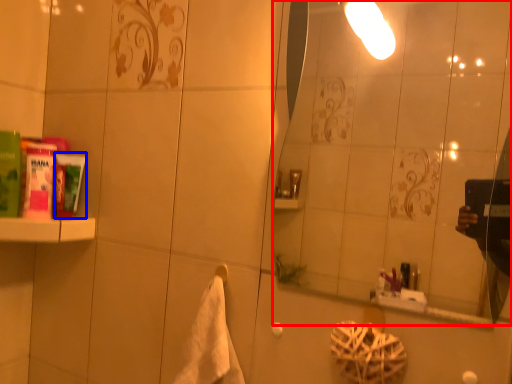
Question: Which object appears farthest to the camera in this image, mirror (highlighted by a red box) or mouthwash (highlighted by a blue box)?

Choices:
 (A) mirror
 (B) mouthwash

Answer: (B)